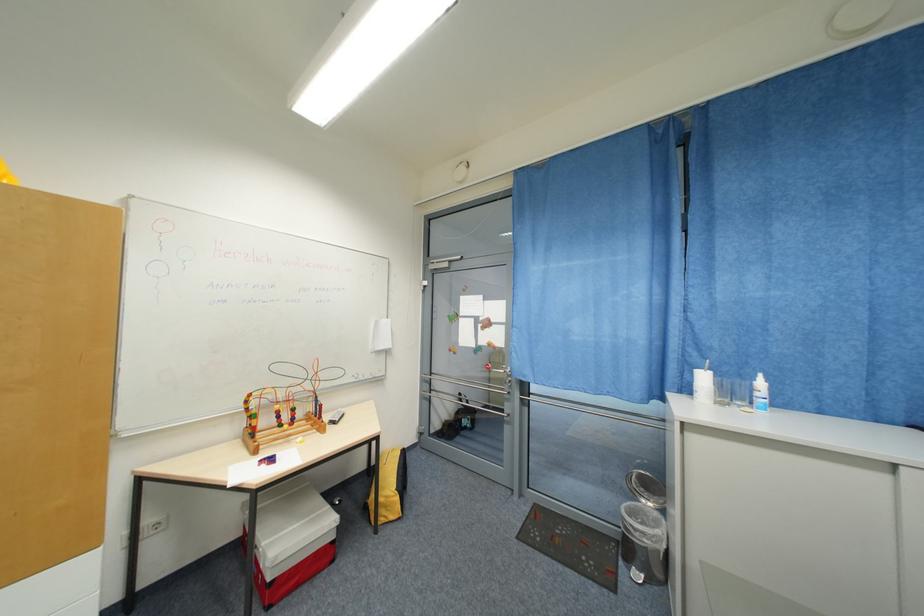
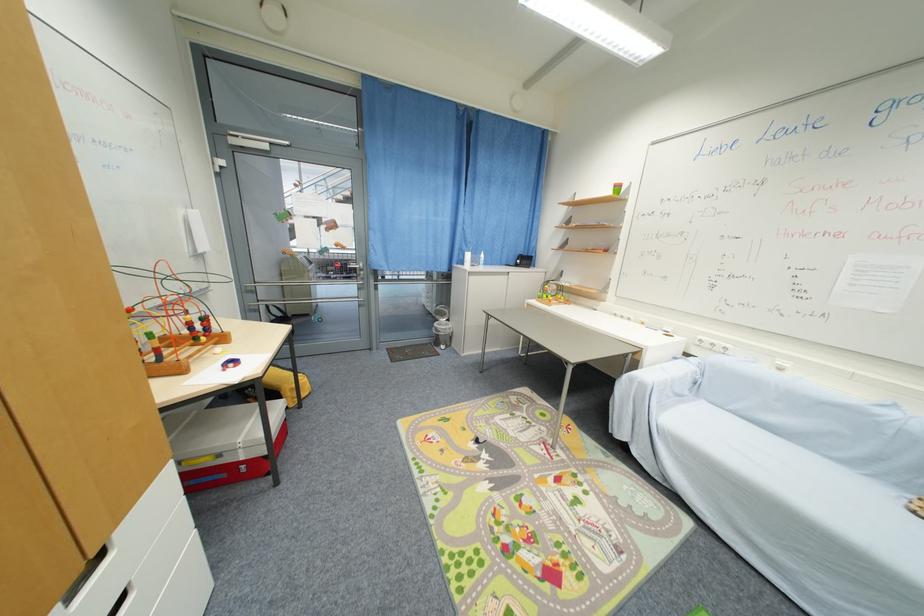
In the second image, find the point that corresponds to the point at 286,427 in the first image.

(201, 341)